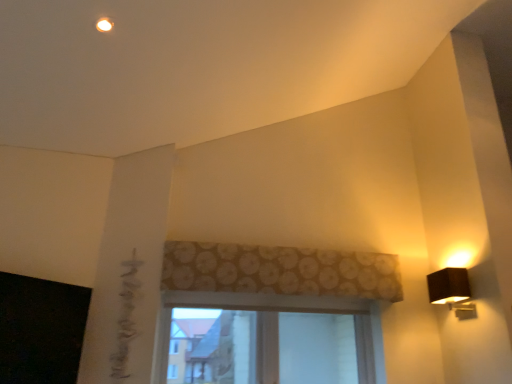
Question: From a real-world perspective, relative to clear glass window at center, is brown floral fabric at center vertically above or below?

Choices:
 (A) below
 (B) above

Answer: (B)

Question: Is brown floral fabric at center spatially inside clear glass window at center, or outside of it?

Choices:
 (A) outside
 (B) inside

Answer: (A)

Question: Estimate the real-world distances between objects in this image. Which object is farther from the clear glass window at center?

Choices:
 (A) black matte window screen at lower left
 (B) brown floral fabric at center
 (C) black fabric lamp at right

Answer: (A)

Question: Which is nearer to the clear glass window at center?

Choices:
 (A) brown floral fabric at center
 (B) black fabric lamp at right
 (C) black matte window screen at lower left

Answer: (A)